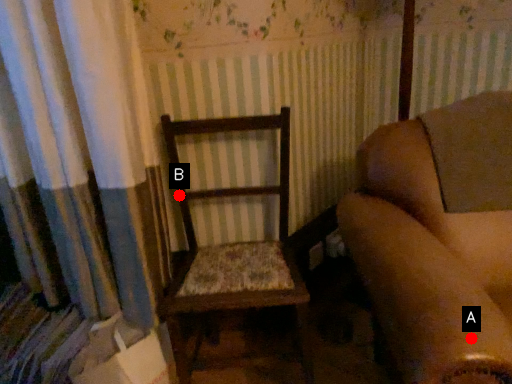
Question: Two points are circled on the image, labeled by A and B beside each circle. Which point is closer to the camera?

Choices:
 (A) A is closer
 (B) B is closer

Answer: (A)